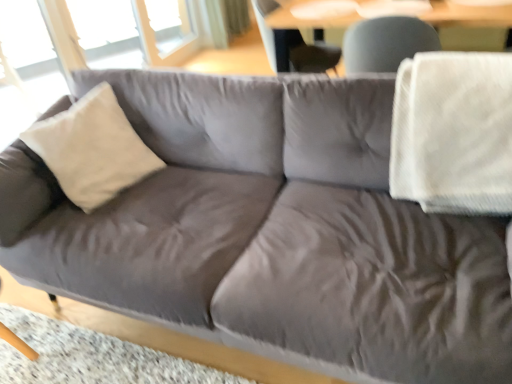
Measure the distance between white textured blanket at right and camera.

white textured blanket at right and camera are 1.21 meters apart from each other.

This screenshot has height=384, width=512. Identify the location of transparent glass window at upper left. point(104,27).

This screenshot has width=512, height=384. Find the location of `matte gray swivel chair at upper center`. matte gray swivel chair at upper center is located at coordinates (294, 46).

Considering the positions of objects matte gray swivel chair at upper center and beige fabric pillow at left in the image provided, who is more to the right, matte gray swivel chair at upper center or beige fabric pillow at left?

Positioned to the right is matte gray swivel chair at upper center.

From the image's perspective, would you say matte gray swivel chair at upper center is shown under beige fabric pillow at left?

No, from the image's perspective, matte gray swivel chair at upper center is not beneath beige fabric pillow at left.

Based on the photo, which object is closer to the camera, matte gray swivel chair at upper center or beige fabric pillow at left?

beige fabric pillow at left is more forward.

How distant is matte gray swivel chair at upper center from beige fabric pillow at left?

matte gray swivel chair at upper center and beige fabric pillow at left are 4.85 feet apart from each other.

Who is shorter, beige fabric pillow at left or white textured blanket at right?

white textured blanket at right is shorter.

Relative to white textured blanket at right, is beige fabric pillow at left in front or behind?

Clearly, beige fabric pillow at left is behind white textured blanket at right.

Is beige fabric pillow at left not near white textured blanket at right?

Yes.

Consider the image. Looking at the image, does beige fabric pillow at left seem bigger or smaller compared to white textured blanket at right?

In the image, beige fabric pillow at left appears to be smaller than white textured blanket at right.

In the scene shown: Is white textured blanket at right in contact with matte gray swivel chair at upper center?

No, white textured blanket at right is not in contact with matte gray swivel chair at upper center.

Between white textured blanket at right and matte gray swivel chair at upper center, which one is positioned in front?

white textured blanket at right is in front.

Is white textured blanket at right aimed at matte gray swivel chair at upper center?

No, white textured blanket at right is not facing towards matte gray swivel chair at upper center.

Where is `swivel chair below the white textured blanket at right (from a real-world perspective)`? swivel chair below the white textured blanket at right (from a real-world perspective) is located at coordinates (294, 46).

From a real-world perspective, between transparent glass window at upper left and matte gray swivel chair at upper center, who is vertically higher?

From a 3D spatial view, matte gray swivel chair at upper center is above.

Can you confirm if transparent glass window at upper left is shorter than matte gray swivel chair at upper center?

No.

Measure the distance from transparent glass window at upper left to matte gray swivel chair at upper center.

transparent glass window at upper left and matte gray swivel chair at upper center are 1.96 meters apart from each other.

Which is closer to the camera, (104, 39) or (267, 6)?

Clearly, point (104, 39) is more distant from the camera than point (267, 6).

Is point (315, 47) closer to camera compared to point (435, 182)?

No, (315, 47) is further to viewer.

Which is more to the left, matte gray swivel chair at upper center or white textured blanket at right?

From the viewer's perspective, matte gray swivel chair at upper center appears more on the left side.

From a real-world perspective, is matte gray swivel chair at upper center positioned above or below white textured blanket at right?

In terms of real-world spatial position, matte gray swivel chair at upper center is below white textured blanket at right.

Does white textured blanket at right come behind beige fabric pillow at left?

No, white textured blanket at right is in front of beige fabric pillow at left.

What's the angular difference between white textured blanket at right and beige fabric pillow at left's facing directions?

57.2 degrees.

Could you tell me if white textured blanket at right is turned towards beige fabric pillow at left?

No, white textured blanket at right is not turned towards beige fabric pillow at left.

Based on the photo, from a real-world perspective, between white textured blanket at right and beige fabric pillow at left, who is vertically higher?

white textured blanket at right, from a real-world perspective.

Relative to beige fabric pillow at left, is transparent glass window at upper left in front or behind?

transparent glass window at upper left is positioned farther from the viewer than beige fabric pillow at left.

From the picture: Is transparent glass window at upper left situated inside beige fabric pillow at left or outside?

transparent glass window at upper left is outside beige fabric pillow at left.

Is transparent glass window at upper left taller than beige fabric pillow at left?

Yes.

Where is `throw pillow on the left side of matte gray swivel chair at upper center`? The width and height of the screenshot is (512, 384). throw pillow on the left side of matte gray swivel chair at upper center is located at coordinates (92, 149).

Image resolution: width=512 pixels, height=384 pixels. Identify the location of blanket in front of the beige fabric pillow at left. (453, 133).

Considering their positions, is beige fabric pillow at left positioned closer to matte gray swivel chair at upper center than white textured blanket at right?

Based on the image, white textured blanket at right appears to be nearer to matte gray swivel chair at upper center.

From the image, which object appears to be nearer to white textured blanket at right, matte gray swivel chair at upper center or transparent glass window at upper left?

Based on the image, matte gray swivel chair at upper center appears to be nearer to white textured blanket at right.

From the image, which object appears to be farther from beige fabric pillow at left, transparent glass window at upper left or white textured blanket at right?

transparent glass window at upper left.

Looking at the image, which one is located further to transparent glass window at upper left, matte gray swivel chair at upper center or beige fabric pillow at left?

beige fabric pillow at left is further to transparent glass window at upper left.

Considering their positions, is transparent glass window at upper left positioned closer to beige fabric pillow at left than matte gray swivel chair at upper center?

matte gray swivel chair at upper center lies closer to beige fabric pillow at left than the other object.

Estimate the real-world distances between objects in this image. Which object is closer to white textured blanket at right, beige fabric pillow at left or transparent glass window at upper left?

beige fabric pillow at left is closer to white textured blanket at right.

When comparing their distances from transparent glass window at upper left, does white textured blanket at right or matte gray swivel chair at upper center seem closer?

matte gray swivel chair at upper center lies closer to transparent glass window at upper left than the other object.

Considering their positions, is beige fabric pillow at left positioned further to white textured blanket at right than matte gray swivel chair at upper center?

Based on the image, matte gray swivel chair at upper center appears to be further to white textured blanket at right.

Identify the location of swivel chair located between white textured blanket at right and transparent glass window at upper left in the depth direction. (294, 46).

This screenshot has width=512, height=384. What are the coordinates of `swivel chair between beige fabric pillow at left and transparent glass window at upper left along the z-axis` in the screenshot? It's located at (294, 46).

Image resolution: width=512 pixels, height=384 pixels. In order to click on throw pillow between white textured blanket at right and transparent glass window at upper left along the z-axis in this screenshot , I will do `click(92, 149)`.

This screenshot has width=512, height=384. I want to click on swivel chair located between beige fabric pillow at left and white textured blanket at right in the left-right direction, so click(x=294, y=46).